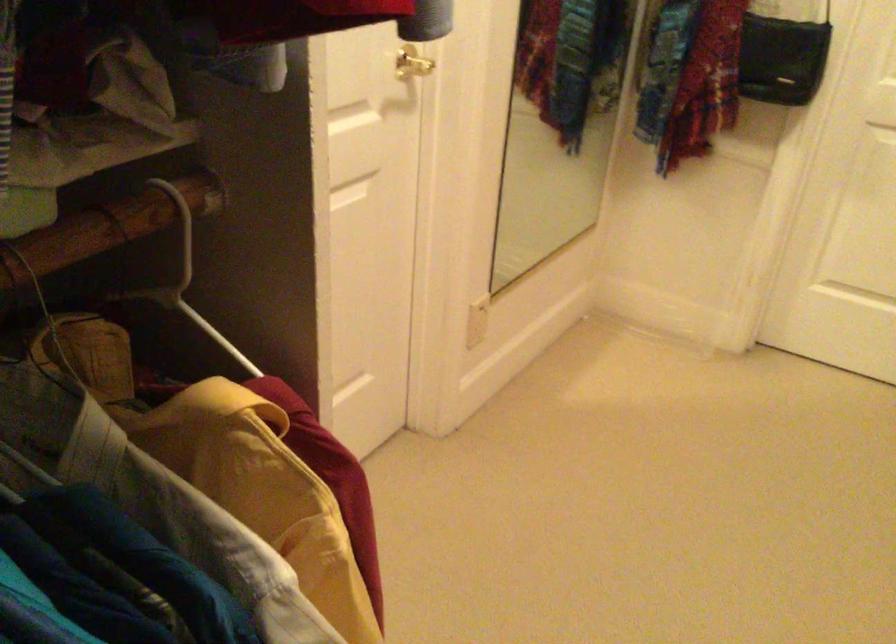
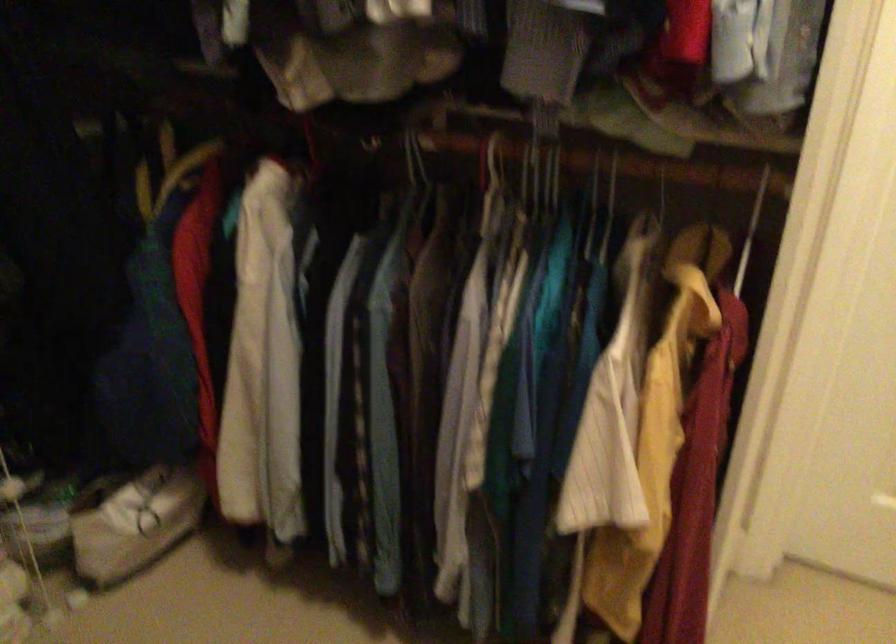
The first image is from the beginning of the video and the second image is from the end. How did the camera likely rotate when shooting the video?

The camera's rotation is toward left-down.